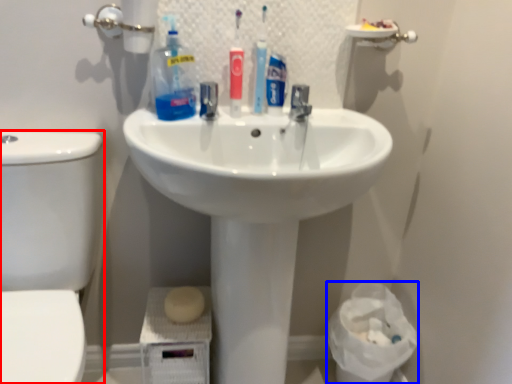
Question: Which object appears closest to the camera in this image, toilet bowl (highlighted by a red box) or toilet paper (highlighted by a blue box)?

Choices:
 (A) toilet bowl
 (B) toilet paper

Answer: (A)